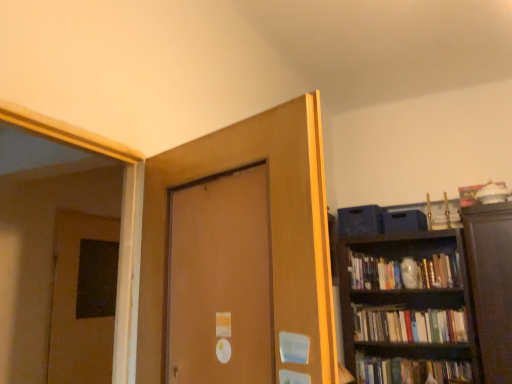
Question: Can you confirm if hardcover books at right is bigger than matte brown door at center, arranged as the second door when viewed from the back?

Choices:
 (A) no
 (B) yes

Answer: (A)

Question: Can you confirm if hardcover books at right is positioned to the left of matte brown door at center, placed as the 2th door when sorted from left to right?

Choices:
 (A) yes
 (B) no

Answer: (B)

Question: Could you tell me if hardcover books at right is facing matte brown door at center, which appears as the 1th door when viewed from the right?

Choices:
 (A) yes
 (B) no

Answer: (A)

Question: From the image's perspective, would you say hardcover books at right is shown under matte brown door at center, placed as the 2th door when sorted from left to right?

Choices:
 (A) no
 (B) yes

Answer: (B)

Question: Can you confirm if hardcover books at right is smaller than matte brown door at center, arranged as the second door when viewed from the back?

Choices:
 (A) yes
 (B) no

Answer: (A)

Question: Is hardcover books at right wider than matte brown door at center, placed as the 2th door when sorted from left to right?

Choices:
 (A) no
 (B) yes

Answer: (A)

Question: Does hardcover books at right lie in front of brown matte door at left, placed as the 1th door when sorted from left to right?

Choices:
 (A) yes
 (B) no

Answer: (B)

Question: Is hardcover books at right behind brown matte door at left, placed as the 1th door when sorted from left to right?

Choices:
 (A) yes
 (B) no

Answer: (A)

Question: From the image's perspective, is hardcover books at right above brown matte door at left, which ranks as the 1th door in back-to-front order?

Choices:
 (A) yes
 (B) no

Answer: (B)

Question: Can you confirm if hardcover books at right is smaller than brown matte door at left, placed as the second door when sorted from front to back?

Choices:
 (A) yes
 (B) no

Answer: (A)

Question: From a real-world perspective, is hardcover books at right below brown matte door at left, which ranks as the 1th door in back-to-front order?

Choices:
 (A) no
 (B) yes

Answer: (B)

Question: Is hardcover books at right surrounding brown matte door at left, placed as the second door when sorted from front to back?

Choices:
 (A) no
 (B) yes

Answer: (A)

Question: Are matte brown door at center, the first door when ordered from front to back, and brown matte door at left, placed as the 1th door when sorted from left to right, located far from each other?

Choices:
 (A) no
 (B) yes

Answer: (B)